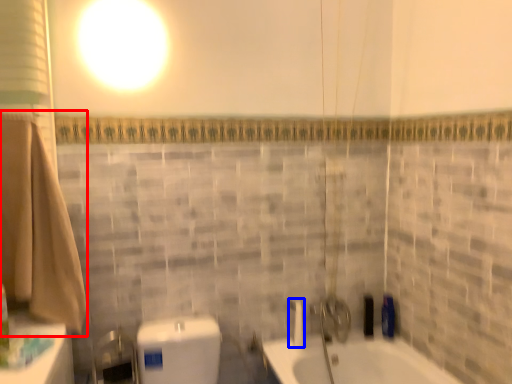
Question: Which point is further to the camera, bath towel (highlighted by a red box) or shower (highlighted by a blue box)?

Choices:
 (A) bath towel
 (B) shower

Answer: (B)